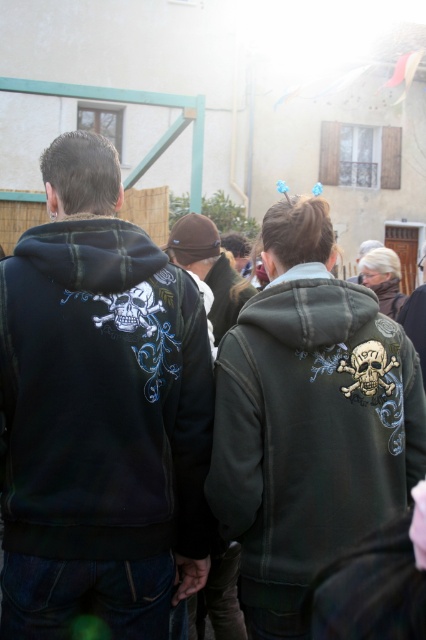
The image size is (426, 640). I want to click on dark green hoodie with skull design at center, so (311, 426).

Is dark green hoodie with skull design at center wider than brown woolen hat at center?

Yes, dark green hoodie with skull design at center is wider than brown woolen hat at center.

Who is more distant from viewer, (397,384) or (244,301)?

Point (244,301)

Where is `dark green hoodie with skull design at center`? The height and width of the screenshot is (640, 426). dark green hoodie with skull design at center is located at coordinates (311, 426).

Does black matte hoodie at left appear under brown woolen hat at center?

Correct, black matte hoodie at left is located below brown woolen hat at center.

The width and height of the screenshot is (426, 640). Describe the element at coordinates (100, 412) in the screenshot. I see `black matte hoodie at left` at that location.

You are a GUI agent. You are given a task and a screenshot of the screen. Output one action in this format:
    pyautogui.click(x=<x>, y=<y>)
    Task: Click on the black matte hoodie at left
    The width and height of the screenshot is (426, 640).
    Given the screenshot: What is the action you would take?
    pyautogui.click(x=100, y=412)

Does black matte hoodie at left appear over dark green hoodie with skull design at center?

Correct, black matte hoodie at left is located above dark green hoodie with skull design at center.

Is black matte hoodie at left to the left of dark green hoodie with skull design at center from the viewer's perspective?

Correct, you'll find black matte hoodie at left to the left of dark green hoodie with skull design at center.

Which is in front, point (85, 170) or point (317, 429)?

Point (317, 429)

What are the coordinates of `black matte hoodie at left` in the screenshot? It's located at (100, 412).